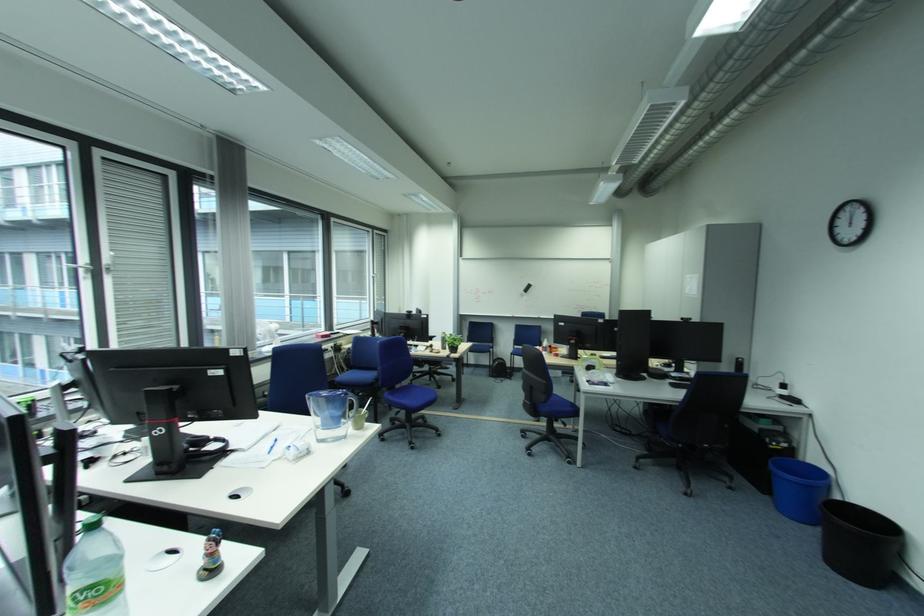
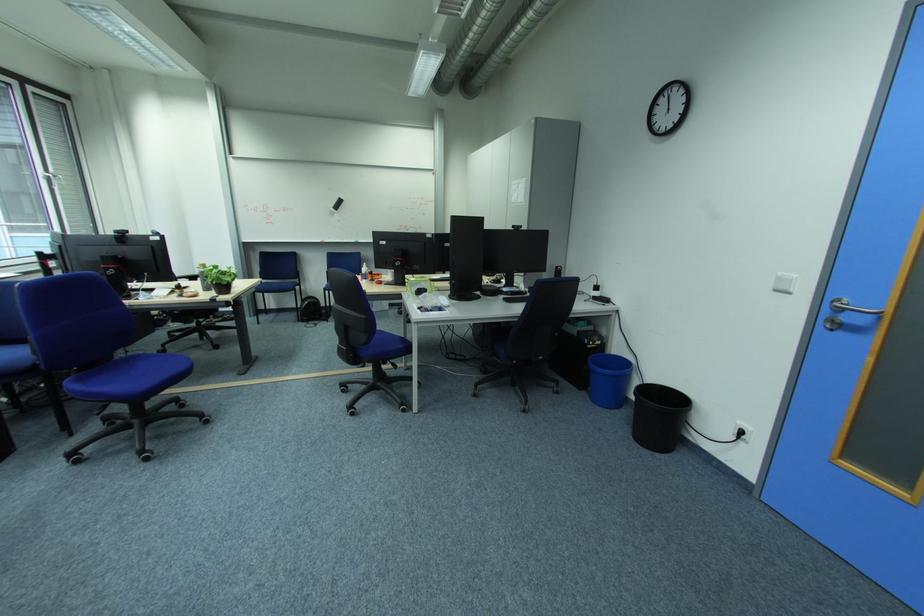
The point at (480, 351) is marked in the first image. Where is the corresponding point in the second image?

(271, 291)